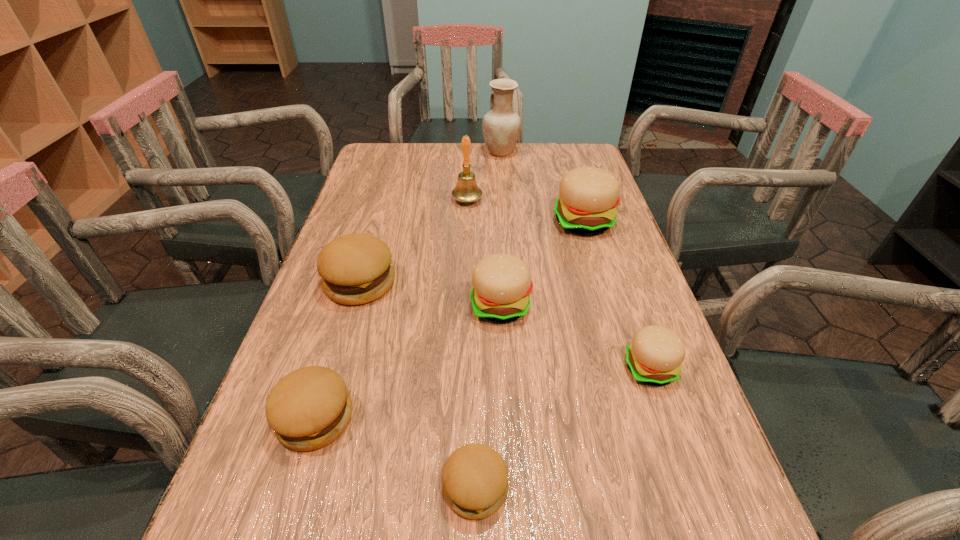
Locate an element on the screen. the nearest object is located at coordinates point(475,478).

Identify the location of the smallest brown hamburger. This screenshot has height=540, width=960. (475, 478).

Where is `free location located 0.230m on the left of the farthest object`? Image resolution: width=960 pixels, height=540 pixels. free location located 0.230m on the left of the farthest object is located at coordinates (414, 152).

Identify the location of vacant space located 0.250m on the back of the bell. This screenshot has width=960, height=540. (469, 153).

Where is `vacant space located on the front of the third tallest object`? vacant space located on the front of the third tallest object is located at coordinates (619, 339).

Identify the location of vacant space located 0.080m on the left of the leftmost beige hamburger. (434, 306).

The height and width of the screenshot is (540, 960). Identify the location of free region located 0.350m on the front of the farthest brown hamburger. (305, 468).

This screenshot has height=540, width=960. What are the coordinates of `vacant space situated on the right of the second smallest brown hamburger` in the screenshot? It's located at (527, 418).

Locate an element on the screen. vacant space located on the back of the nearest beige hamburger is located at coordinates (612, 258).

At what (x,y) coordinates should I click in order to perform the action: click on vacant space located 0.340m on the back of the shortest hamburger. Please return your answer as a coordinate pair (x, y). The image size is (960, 540). Looking at the image, I should click on (477, 305).